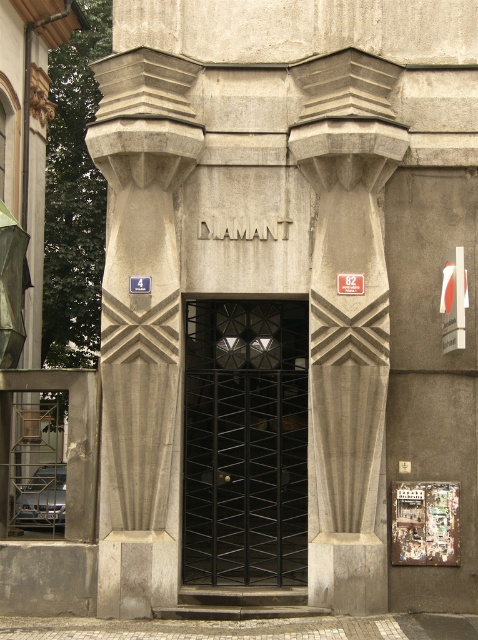
You are a delivery person trying to enter DIAMANT building. You see a gray concrete column at center and a black metal gate at center. Which one is taller?

The gray concrete column at center is taller than the black metal gate at center.

You are standing in front of the entrance of DIAMANT building and want to locate the white plastic sign at right. Which direction should you look relative to the gray stone column at center?

The gray stone column at center is positioned on the left side of white plastic sign at right, so you should look to the right of the gray stone column at center to find the white plastic sign at right.